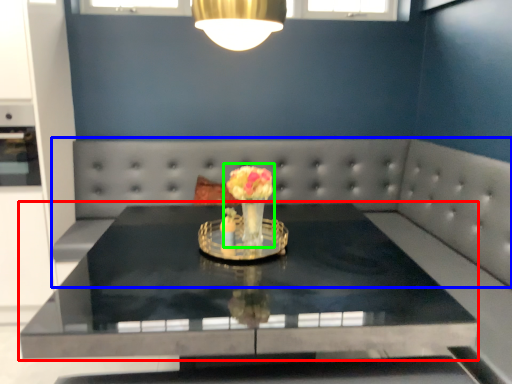
Question: Which object is positioned closest to table (highlighted by a red box)? Select from couch (highlighted by a blue box) and floral arrangement (highlighted by a green box).

Choices:
 (A) couch
 (B) floral arrangement

Answer: (B)